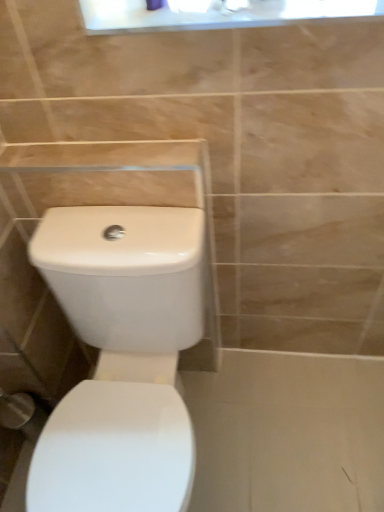
You are a GUI agent. You are given a task and a screenshot of the screen. Output one action in this format:
    pyautogui.click(x=<x>, y=<y>)
    Task: Click on the spots to the right of white glossy toilet at center
    The height and width of the screenshot is (512, 384).
    Given the screenshot: What is the action you would take?
    pyautogui.click(x=287, y=428)